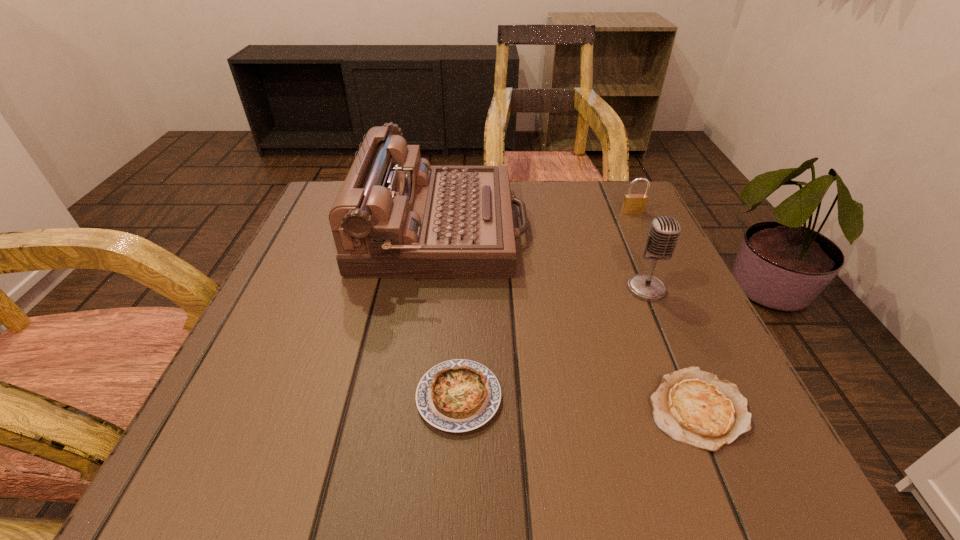
At what (x,y) coordinates should I click in order to perform the action: click on object situated at the near right corner. Please return your answer as a coordinate pair (x, y). This screenshot has width=960, height=540. Looking at the image, I should click on (692, 406).

In the image, there is a desktop. What are the coordinates of `free region at the far edge` in the screenshot? It's located at (556, 223).

Identify the location of free spot at the near edge of the desktop. This screenshot has height=540, width=960. (328, 476).

The height and width of the screenshot is (540, 960). Find the location of `free space at the left edge of the desktop`. free space at the left edge of the desktop is located at coordinates (x=292, y=402).

You are a GUI agent. You are given a task and a screenshot of the screen. Output one action in this format:
    pyautogui.click(x=<x>, y=<y>)
    Task: Click on the free spot at the right edge of the desktop
    The image size is (960, 540).
    Given the screenshot: What is the action you would take?
    pyautogui.click(x=599, y=283)

Image resolution: width=960 pixels, height=540 pixels. In order to click on free space at the far left corner of the desktop in this screenshot , I will do `click(331, 193)`.

Locate an element on the screen. This screenshot has height=540, width=960. vacant space at the near left corner of the desktop is located at coordinates (314, 418).

In the image, there is a desktop. Where is `vacant space at the far right corner`? vacant space at the far right corner is located at coordinates (618, 213).

Image resolution: width=960 pixels, height=540 pixels. I want to click on free area in between the taller quiche and the fourth shortest object, so click(x=552, y=343).

Where is `empty space that is in between the second tallest object and the third shortest object`? empty space that is in between the second tallest object and the third shortest object is located at coordinates (639, 251).